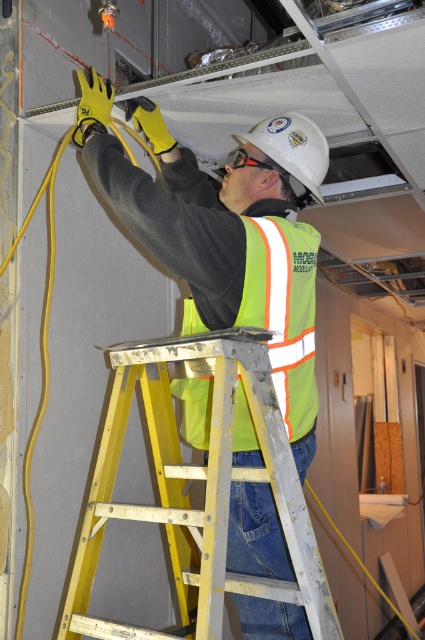
Between yellow metallic ladder at center and high-visibility fabric safety vest at center, which one appears on the right side from the viewer's perspective?

Positioned to the right is high-visibility fabric safety vest at center.

Can you confirm if yellow metallic ladder at center is wider than high-visibility fabric safety vest at center?

Indeed, yellow metallic ladder at center has a greater width compared to high-visibility fabric safety vest at center.

Between point (116, 364) and point (240, 408), which one is positioned in front?

Point (240, 408) is in front.

Where is `yellow metallic ladder at center`? Image resolution: width=425 pixels, height=640 pixels. yellow metallic ladder at center is located at coordinates (204, 486).